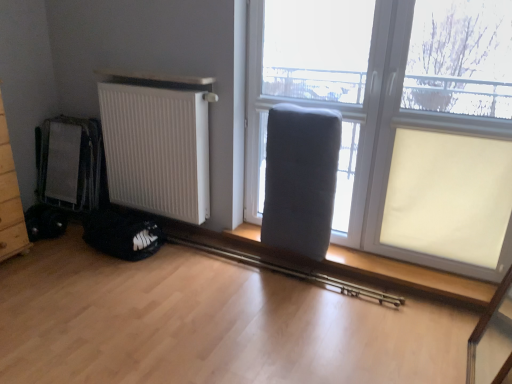
Question: Visually, is gray fabric armchair at center positioned to the left or to the right of matte gray cushion at center?

Choices:
 (A) left
 (B) right

Answer: (A)

Question: In the image, is gray fabric armchair at center positioned in front of or behind matte gray cushion at center?

Choices:
 (A) front
 (B) behind

Answer: (B)

Question: Which is nearer to the matte gray cushion at center?

Choices:
 (A) matte gray radiator at lower center
 (B) white matte radiator at left
 (C) gray fabric armchair at center

Answer: (A)

Question: Estimate the real-world distances between objects in this image. Which object is closer to the matte gray cushion at center?

Choices:
 (A) white matte radiator at left
 (B) matte gray radiator at lower center
 (C) gray fabric armchair at center

Answer: (B)